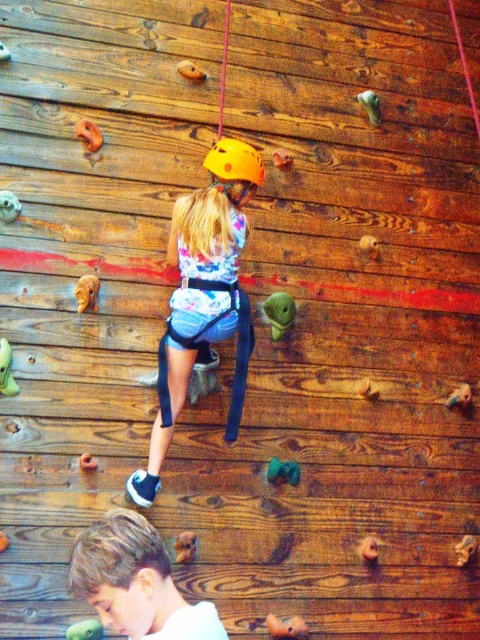
Question: Can you confirm if blonde hair boy at lower left is positioned above yellow matte helmet at center?

Choices:
 (A) no
 (B) yes

Answer: (A)

Question: Does matte yellow helmet at center appear on the left side of yellow matte helmet at center?

Choices:
 (A) yes
 (B) no

Answer: (A)

Question: Which point is farther to the camera?

Choices:
 (A) (154, 592)
 (B) (222, 163)
 (C) (216, 248)

Answer: (C)

Question: Which point is closer to the camera?

Choices:
 (A) matte yellow helmet at center
 (B) blonde hair boy at lower left

Answer: (B)

Question: Does matte yellow helmet at center have a larger size compared to blonde hair boy at lower left?

Choices:
 (A) no
 (B) yes

Answer: (B)

Question: Considering the real-world distances, which object is closest to the matte yellow helmet at center?

Choices:
 (A) yellow matte helmet at center
 (B) blonde hair boy at lower left

Answer: (A)